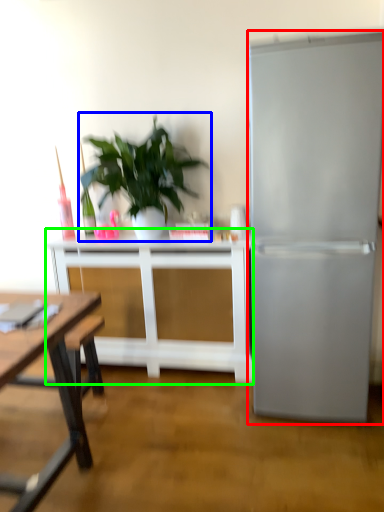
Question: Considering the real-world distances, which object is farthest from refrigerator (highlighted by a red box)? houseplant (highlighted by a blue box) or table (highlighted by a green box)?

Choices:
 (A) houseplant
 (B) table

Answer: (A)